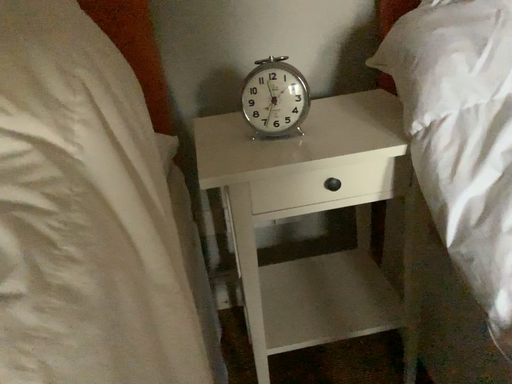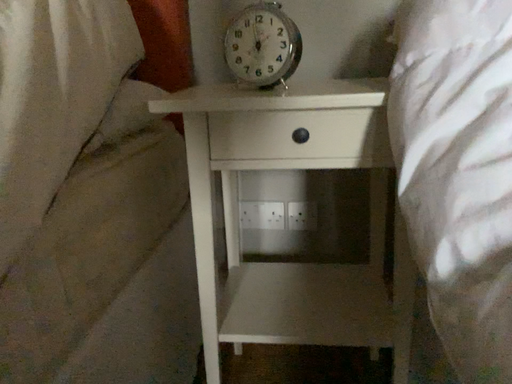
Question: Which way did the camera rotate in the video?

Choices:
 (A) rotated left
 (B) rotated right

Answer: (A)